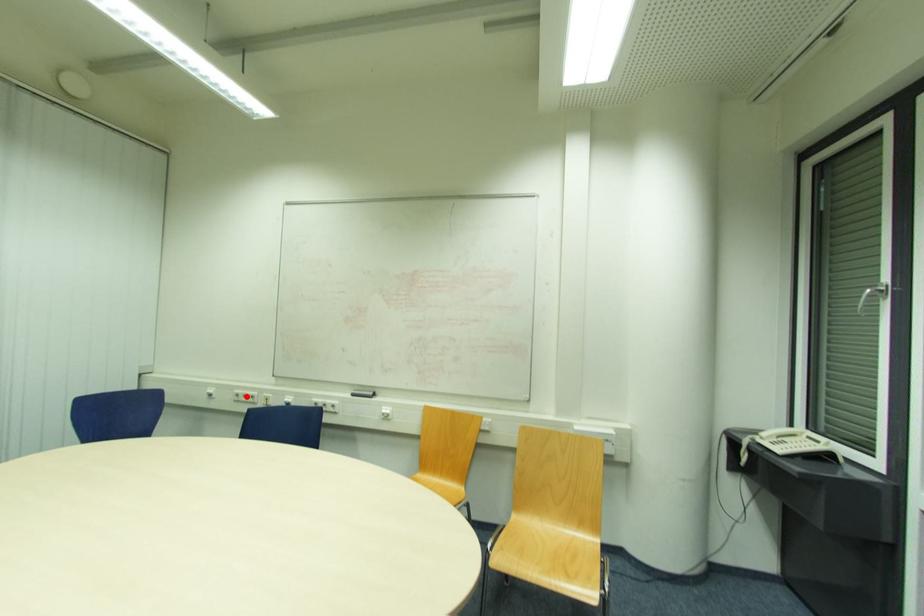
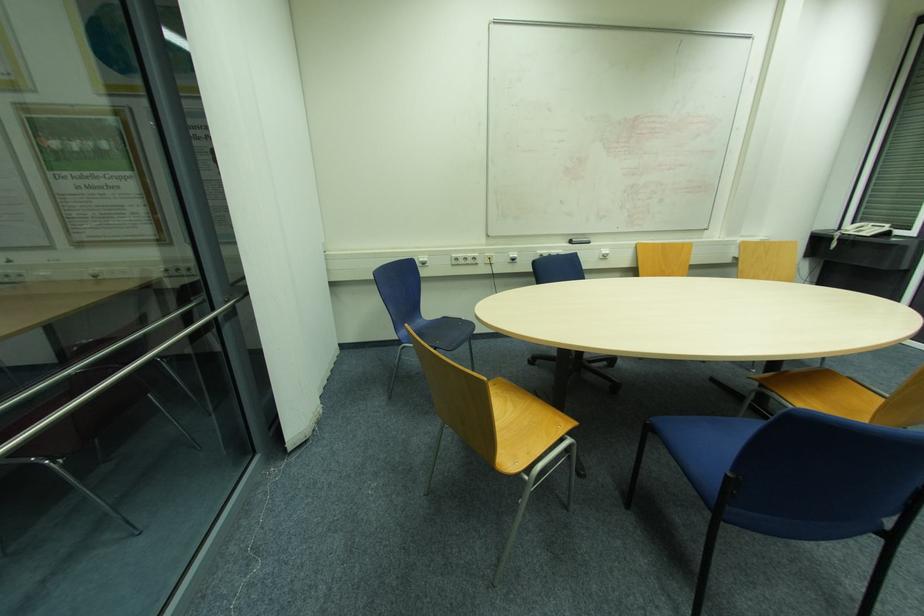
Find the pixel in the second image that matches the highlighted location in the first image.

(467, 259)